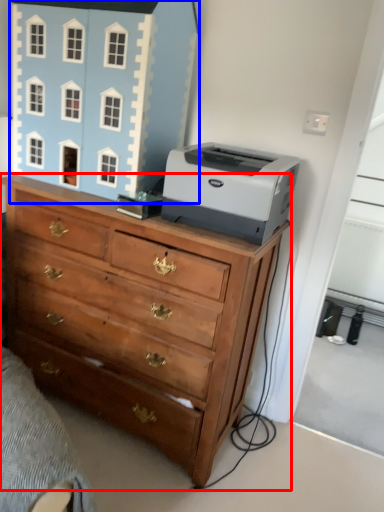
Question: Which object appears farthest to the camera in this image, chest of drawers (highlighted by a red box) or toy (highlighted by a blue box)?

Choices:
 (A) chest of drawers
 (B) toy

Answer: (B)